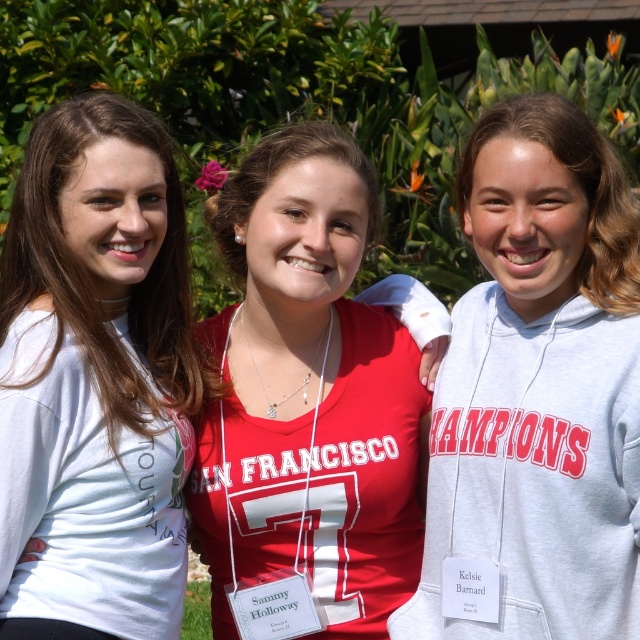
Question: Is white matte shirt at center positioned in front of gray fleece sweatshirt at center?

Choices:
 (A) yes
 (B) no

Answer: (A)

Question: Which point is closer to the camera taking this photo?

Choices:
 (A) click(52, 291)
 (B) click(632, 364)

Answer: (B)

Question: Does white matte shirt at center have a larger size compared to gray fleece sweatshirt at center?

Choices:
 (A) no
 (B) yes

Answer: (B)

Question: Is white matte shirt at center smaller than gray fleece sweatshirt at center?

Choices:
 (A) yes
 (B) no

Answer: (B)